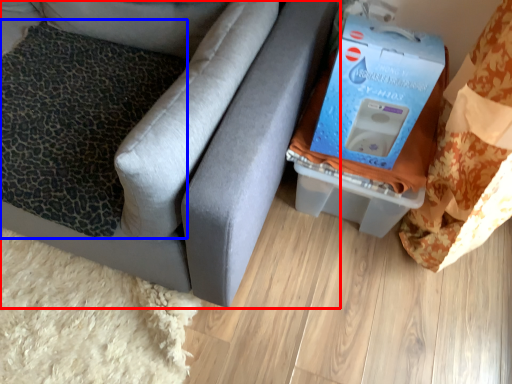
Question: Which point is further to the camera, furniture (highlighted by a red box) or pillow (highlighted by a blue box)?

Choices:
 (A) furniture
 (B) pillow

Answer: (B)